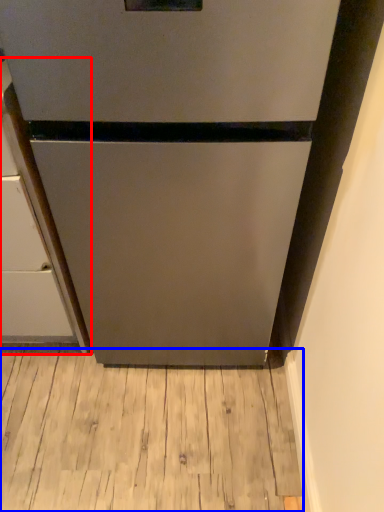
Question: Which object appears closest to the camera in this image, cabinetry (highlighted by a red box) or hardwood (highlighted by a blue box)?

Choices:
 (A) cabinetry
 (B) hardwood

Answer: (A)